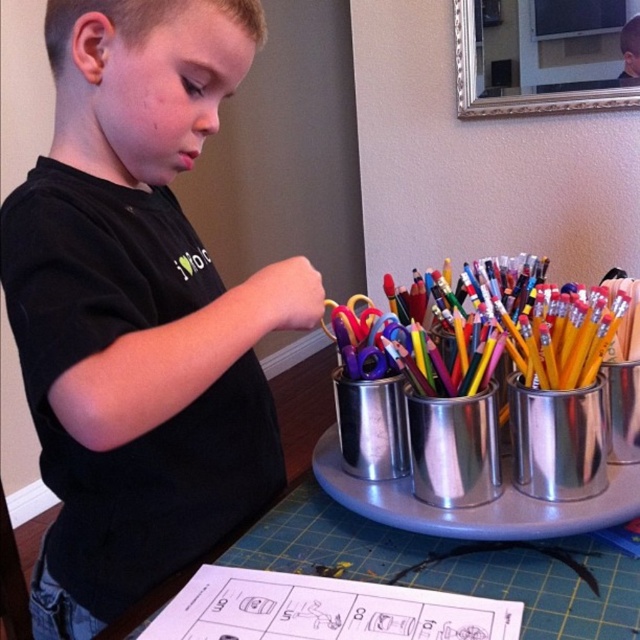
Question: Which object is farther from the camera taking this photo?

Choices:
 (A) black matte shirt at center
 (B) metallic silver canisters at center

Answer: (B)

Question: Which object is closer to the camera taking this photo?

Choices:
 (A) black matte shirt at center
 (B) metallic silver canisters at center

Answer: (A)

Question: Can you confirm if black matte shirt at center is smaller than metallic silver canisters at center?

Choices:
 (A) no
 (B) yes

Answer: (A)

Question: Does black matte shirt at center have a smaller size compared to metallic silver canisters at center?

Choices:
 (A) no
 (B) yes

Answer: (A)

Question: Can you confirm if black matte shirt at center is smaller than metallic silver canisters at center?

Choices:
 (A) no
 (B) yes

Answer: (A)